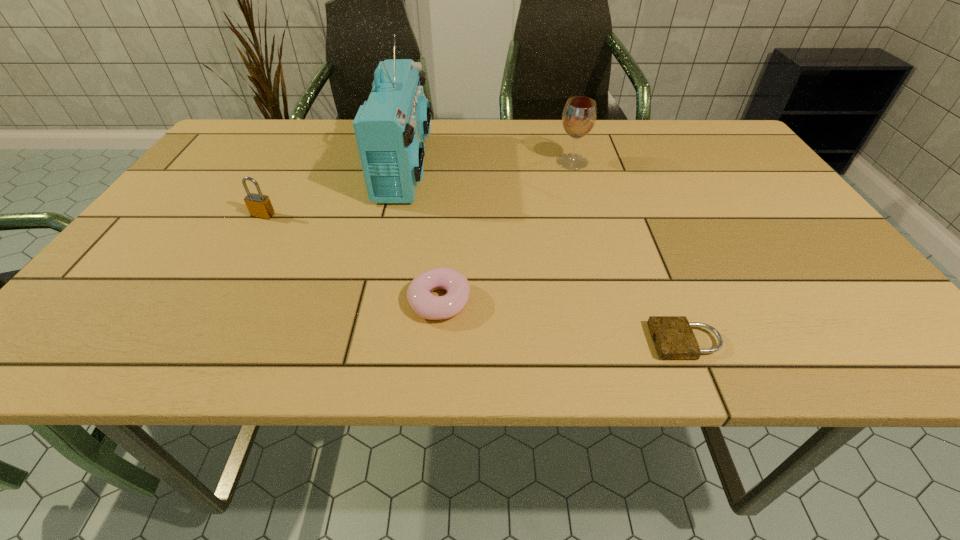
The height and width of the screenshot is (540, 960). In order to click on the tallest object in this screenshot , I will do `click(391, 127)`.

Find the location of a particular element. Image resolution: width=960 pixels, height=540 pixels. the fourth shortest object is located at coordinates (579, 115).

The image size is (960, 540). I want to click on wineglass, so click(x=579, y=115).

Locate an element on the screen. Image resolution: width=960 pixels, height=540 pixels. the third tallest object is located at coordinates (259, 205).

The image size is (960, 540). What are the coordinates of `the third nearest object` in the screenshot? It's located at (259, 205).

Image resolution: width=960 pixels, height=540 pixels. I want to click on the fourth tallest object, so click(x=424, y=304).

At what (x,y) coordinates should I click in order to perform the action: click on the rightmost object. Please return your answer as a coordinate pair (x, y). Looking at the image, I should click on (673, 338).

Locate an element on the screen. The height and width of the screenshot is (540, 960). the shorter padlock is located at coordinates (673, 338).

At what (x,y) coordinates should I click in order to perform the action: click on vacant space located 0.190m on the front-facing side of the radio receiver. Please return your answer as a coordinate pair (x, y). Looking at the image, I should click on (501, 167).

This screenshot has height=540, width=960. Identify the location of free location located 0.150m on the right of the second object from right to left. (644, 162).